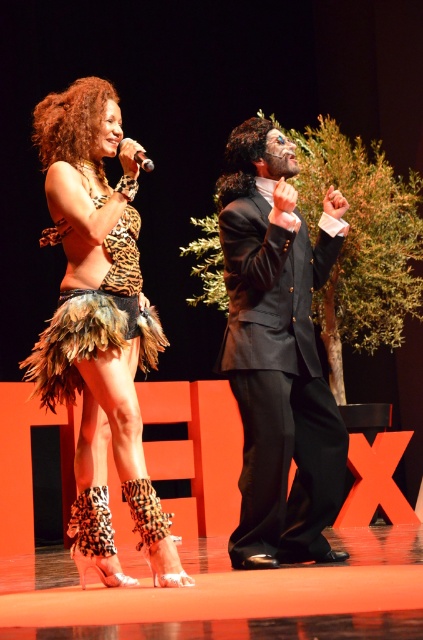
In the scene shown: You are a photographer positioned behind the stage. You need to capture a photo that includes both the leopard print feather skirt at center and the shiny black suit at center. What is the minimum width of the camera lens you need to ensure both subjects are fully in frame?

The minimum width of the camera lens should be at least 27.29 inches to ensure both the leopard print feather skirt at center and the shiny black suit at center are fully captured in the photo.